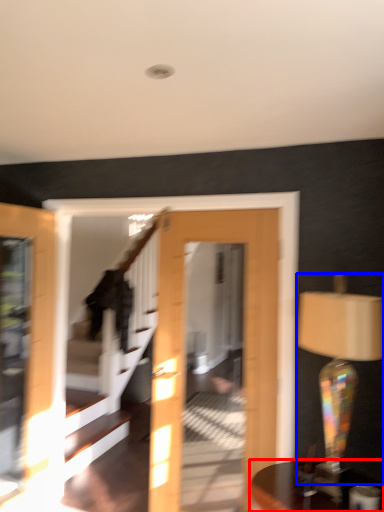
Question: Which object is closer to the camera taking this photo, table (highlighted by a red box) or table lamp (highlighted by a blue box)?

Choices:
 (A) table
 (B) table lamp

Answer: (A)